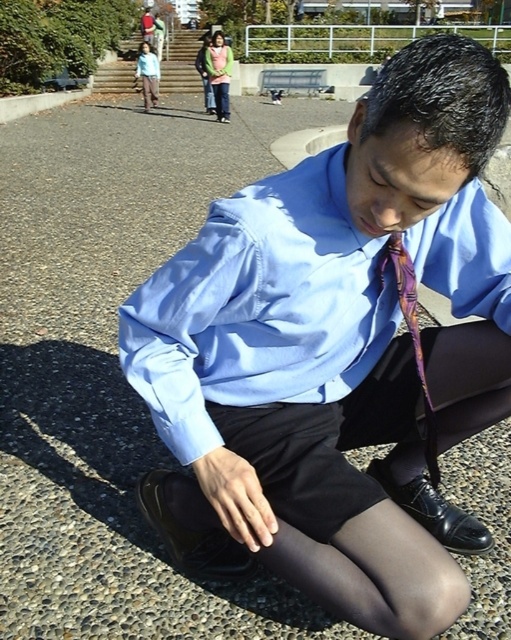
Which is in front, point (245, 289) or point (382, 280)?

Positioned in front is point (245, 289).

Is matte blue shirt at center behind purple silky tie at center?

No, it is not.

Find the location of a particular element. This screenshot has width=511, height=640. matte blue shirt at center is located at coordinates (336, 353).